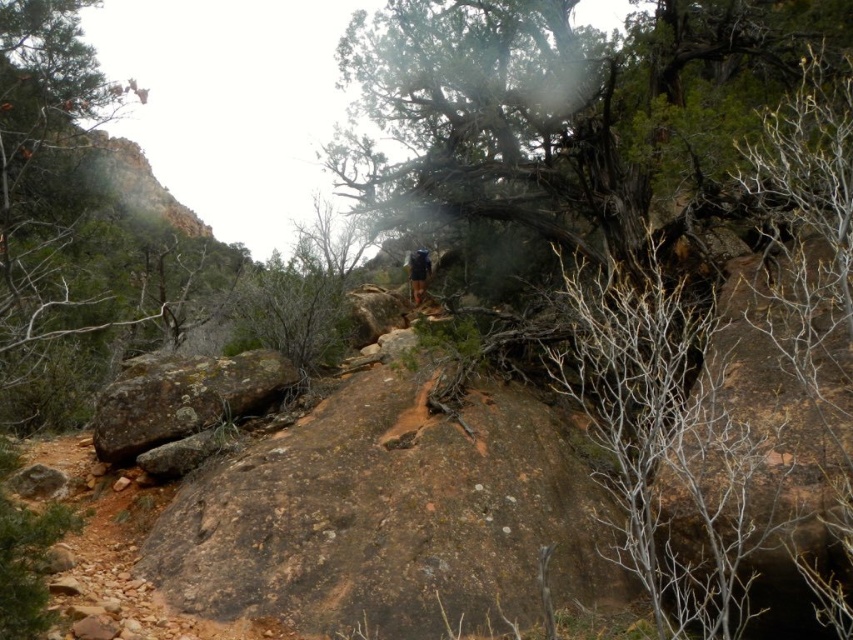
Question: Which point appears farthest from the camera in this image?

Choices:
 (A) (259, 355)
 (B) (416, 266)

Answer: (B)

Question: Among these objects, which one is farthest from the camera?

Choices:
 (A) rusty brown rock at lower left
 (B) dark blue jacket at center

Answer: (B)

Question: Is rusty brown rock at lower left wider than dark blue jacket at center?

Choices:
 (A) no
 (B) yes

Answer: (B)

Question: Among these objects, which one is nearest to the camera?

Choices:
 (A) rusty brown rock at lower left
 (B) dark blue jacket at center

Answer: (A)

Question: Does rusty brown rock at lower left have a smaller size compared to dark blue jacket at center?

Choices:
 (A) no
 (B) yes

Answer: (A)

Question: Observing the image, what is the correct spatial positioning of rusty brown rock at lower left in reference to dark blue jacket at center?

Choices:
 (A) left
 (B) right

Answer: (A)